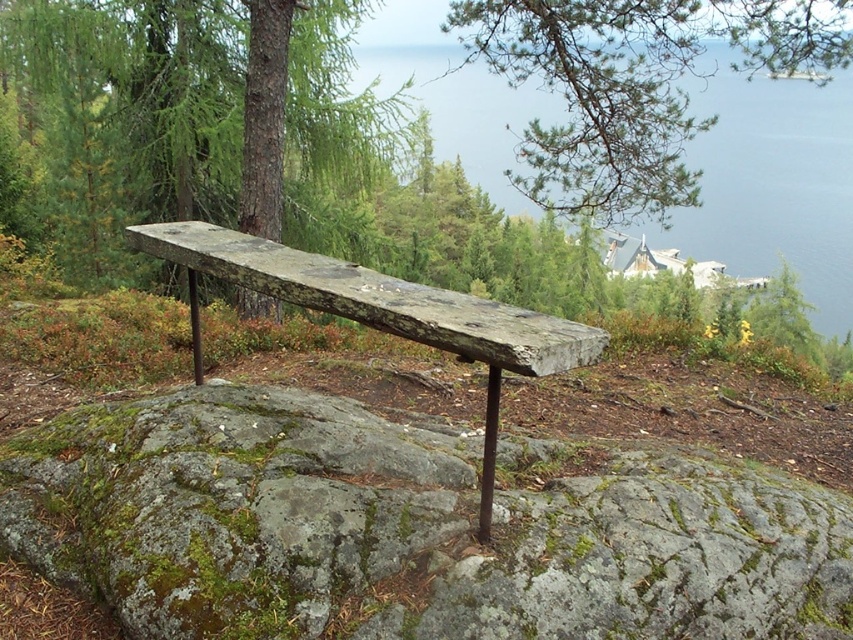
You are a hiker who wants to sit on the weathered wood bench at center. Before you do, you notice the green textured pine branch at upper center. What is the position of the pine branch relative to the bench?

The green textured pine branch at upper center is positioned over the weathered wood bench at center, so it is above the bench.

You are an artist sketching the scene. You notice the green textured pine branch at upper center and the transparent blue water at upper center. Which object would require more detailed shading due to its texture?

The green textured pine branch at upper center would require more detailed shading due to its texture, as it is thinner than the transparent blue water at upper center.